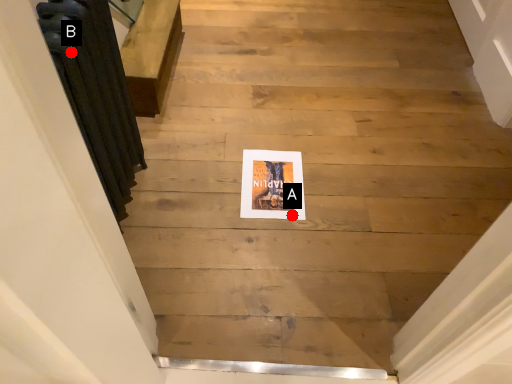
Question: Two points are circled on the image, labeled by A and B beside each circle. Which point is closer to the camera?

Choices:
 (A) A is closer
 (B) B is closer

Answer: (B)